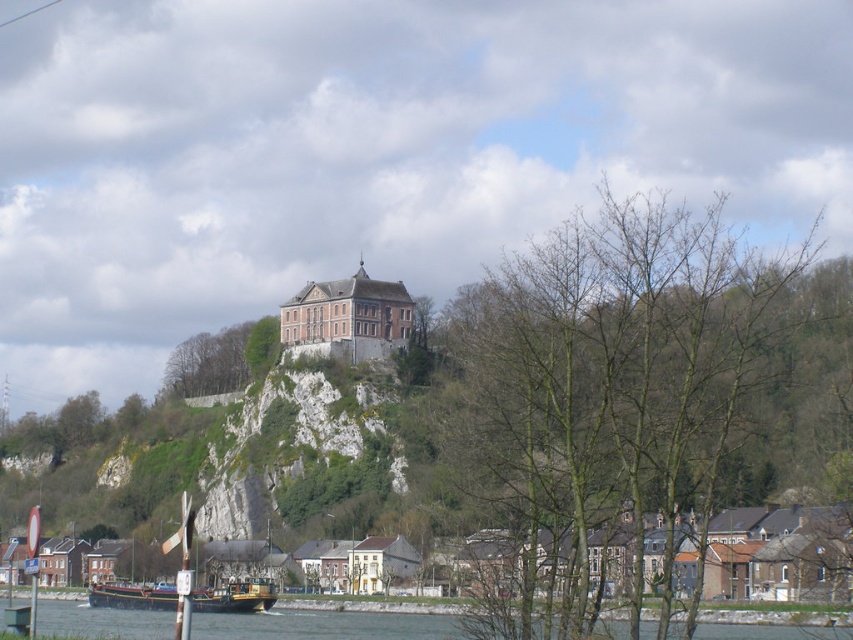
You are an artist planning to sketch the scene. You want to ensure the proportions between the bare branches at center and the matte stone castle at upper center are accurate. Which object should you draw first to establish the scale, and why?

You should draw the bare branches at center first because they are larger in size compared to the matte stone castle at upper center, allowing you to set the scale before adding smaller details.

You are an artist planning to sketch the scene. You need to decide which object to draw first based on their widths. Which one should you start with, the bare branches at center or the matte stone castle at upper center?

The bare branches at center might be wider than the matte stone castle at upper center, so you should start with the wider one, the bare branches at center.